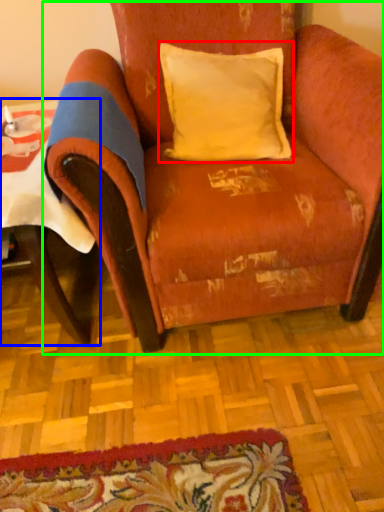
Question: Which is nearer to the pillow (highlighted by a red box)? table (highlighted by a blue box) or chair (highlighted by a green box).

Choices:
 (A) table
 (B) chair

Answer: (B)